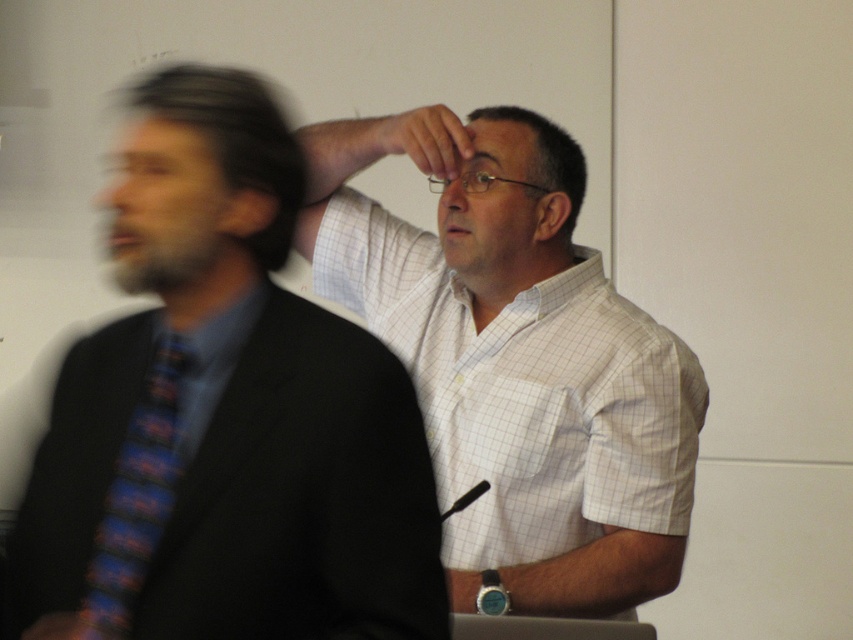
Looking at this image, can you confirm if blue striped tie at left is thinner than matte white forehead at upper center?

Correct, blue striped tie at left's width is less than matte white forehead at upper center's.

Is point (109, 520) closer to viewer compared to point (508, 145)?

Yes, it is in front of point (508, 145).

Is point (178, 388) farther from camera compared to point (488, 122)?

That is False.

The image size is (853, 640). What are the coordinates of `blue striped tie at left` in the screenshot? It's located at (136, 497).

Where is `dark brown hair at left`? The image size is (853, 640). dark brown hair at left is located at coordinates (236, 141).

Is dark brown hair at left smaller than matte black glasses at upper center?

Yes.

Which is in front, point (287, 237) or point (425, 113)?

Point (287, 237) is in front.

This screenshot has width=853, height=640. Identify the location of dark brown hair at left. (236, 141).

How much distance is there between matte black suit at left and blue striped tie at left?

matte black suit at left is 4.25 inches from blue striped tie at left.

Which is behind, point (302, 417) or point (114, 484)?

Positioned behind is point (114, 484).

Locate an element on the screen. The width and height of the screenshot is (853, 640). matte black suit at left is located at coordinates (224, 416).